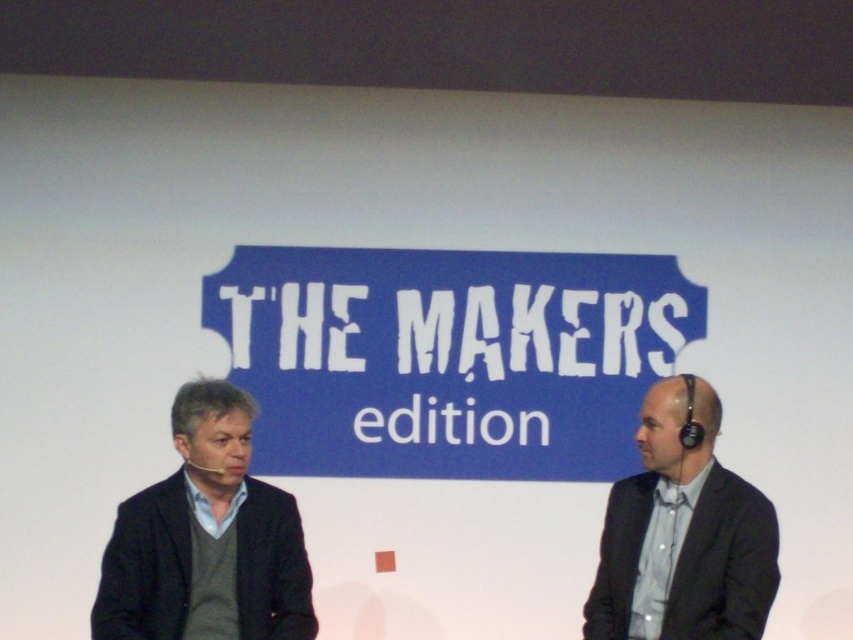
What do you see at coordinates (206, 540) in the screenshot?
I see `dark gray sweater at left` at bounding box center [206, 540].

Is dark gray sweater at left wider than gray fabric suit at right?

Correct, the width of dark gray sweater at left exceeds that of gray fabric suit at right.

Identify the location of dark gray sweater at left. The width and height of the screenshot is (853, 640). (206, 540).